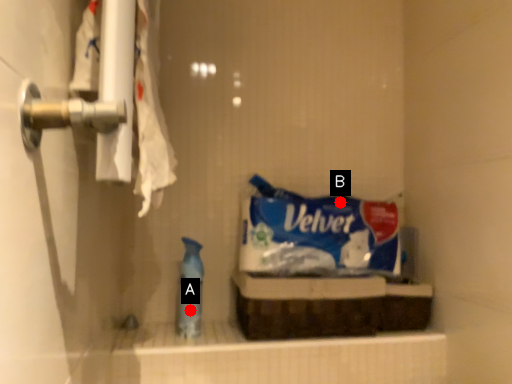
Question: Two points are circled on the image, labeled by A and B beside each circle. Which point appears farthest from the camera in this image?

Choices:
 (A) A is further
 (B) B is further

Answer: (B)